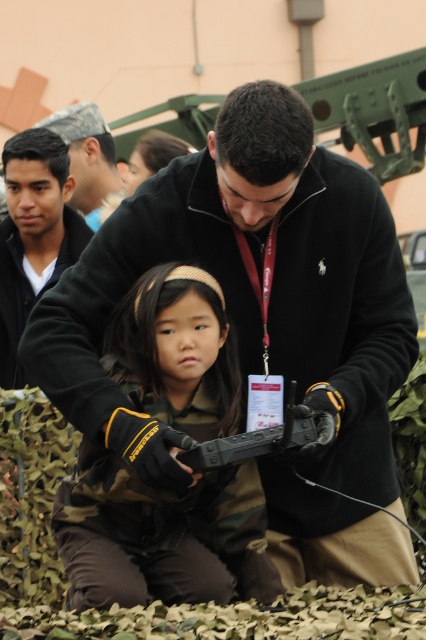
Question: Is camouflage fabric at center to the right of black rubber gun at center from the viewer's perspective?

Choices:
 (A) yes
 (B) no

Answer: (B)

Question: Which object is closer to the camera taking this photo?

Choices:
 (A) matte black jacket at upper left
 (B) camouflage fabric at center

Answer: (B)

Question: Which point appears farthest from the camera in this image?

Choices:
 (A) (201, 456)
 (B) (16, 141)

Answer: (B)

Question: Which point is closer to the camera?

Choices:
 (A) (149, 518)
 (B) (230, 456)

Answer: (B)

Question: Can you confirm if camouflage fabric at center is positioned to the left of black rubber gun at center?

Choices:
 (A) yes
 (B) no

Answer: (A)

Question: Does camouflage fabric at center appear on the right side of black rubber gun at center?

Choices:
 (A) no
 (B) yes

Answer: (A)